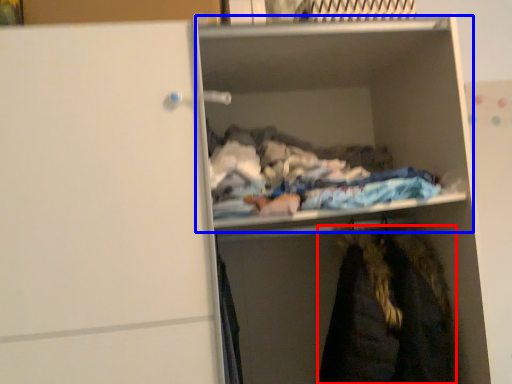
Question: Which object appears closest to the camera in this image, cloak (highlighted by a red box) or cabinet (highlighted by a blue box)?

Choices:
 (A) cloak
 (B) cabinet

Answer: (B)